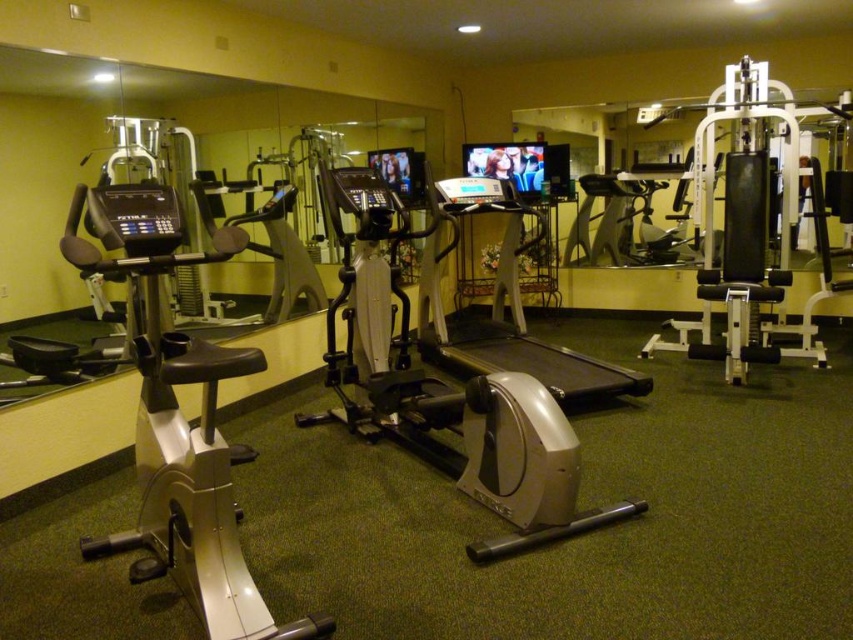
Question: Does silver/plastic elliptical trainer at center have a larger size compared to silver metallic treadmill at center?

Choices:
 (A) yes
 (B) no

Answer: (A)

Question: Which point is farther from the camera taking this photo?

Choices:
 (A) (392, 272)
 (B) (466, 202)

Answer: (B)

Question: Is silver/plastic elliptical trainer at center smaller than silver metallic treadmill at center?

Choices:
 (A) yes
 (B) no

Answer: (B)

Question: Does silver/plastic elliptical trainer at center appear on the right side of silver metallic treadmill at center?

Choices:
 (A) yes
 (B) no

Answer: (B)